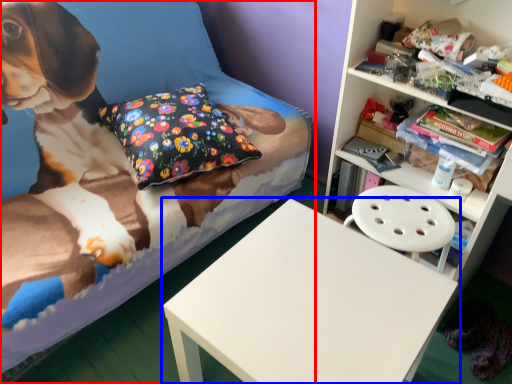
Question: Which object is further to the camera taking this photo, bed (highlighted by a red box) or table (highlighted by a blue box)?

Choices:
 (A) bed
 (B) table

Answer: (B)